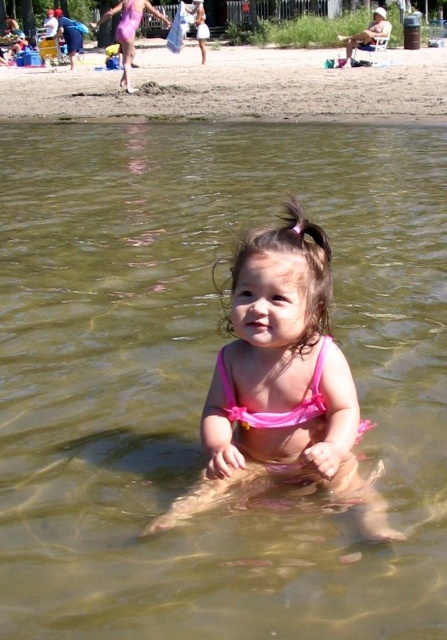
You are a photographer trying to capture the child in the pink fabric swimsuit at center. To ensure the brown sand at upper center is visible in the background, where should you position the camera relative to the child?

Position the camera above the child so the brown sand at upper center appears in the background behind the pink fabric swimsuit at center.

In the scene shown: You are a photographer trying to capture the pink fabric bikini at center in the image. What are the coordinates where you should focus your camera?

The coordinates to focus on are point (281,378).

You are a photographer taking a picture of the beach scene. The child is wearing two pink fabric items at the center. Which one is higher up in the image, the pink fabric bikini at center or the pink fabric swimsuit at center?

The pink fabric bikini at center is located above the pink fabric swimsuit at center in the image.